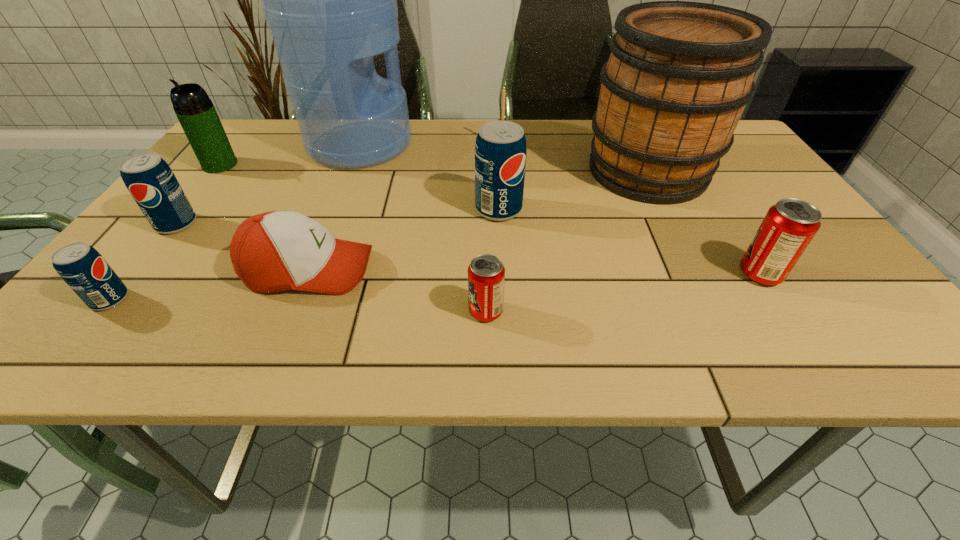
The image size is (960, 540). What are the coordinates of `free space in the image that satisfies the following two spatial constraints: 1. on the side of the blue water jug with the handle; 2. on the left side of the cider` in the screenshot? It's located at (349, 171).

In order to click on vacant point that satisfies the following two spatial constraints: 1. on the front-facing side of the nearer red soda can; 2. on the right side of the orange baseball cap in this screenshot , I will do `click(293, 311)`.

Locate an element on the screen. This screenshot has height=540, width=960. vacant space that satisfies the following two spatial constraints: 1. on the back side of the second tallest object; 2. on the right side of the rightmost blue pop is located at coordinates (496, 171).